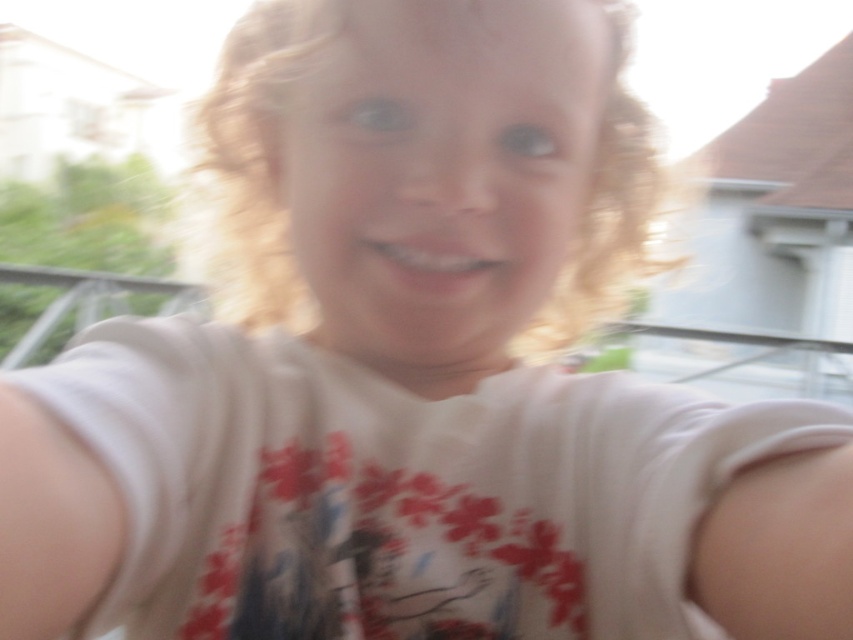
Question: In this image, where is blonde curly hair at center located relative to smooth matte teeth at center?

Choices:
 (A) right
 (B) left

Answer: (B)

Question: Which point appears closest to the camera in this image?

Choices:
 (A) (215, 184)
 (B) (476, 264)

Answer: (B)

Question: Does blonde curly hair at center come in front of smooth matte teeth at center?

Choices:
 (A) yes
 (B) no

Answer: (A)

Question: Is blonde curly hair at center above smooth matte teeth at center?

Choices:
 (A) no
 (B) yes

Answer: (B)